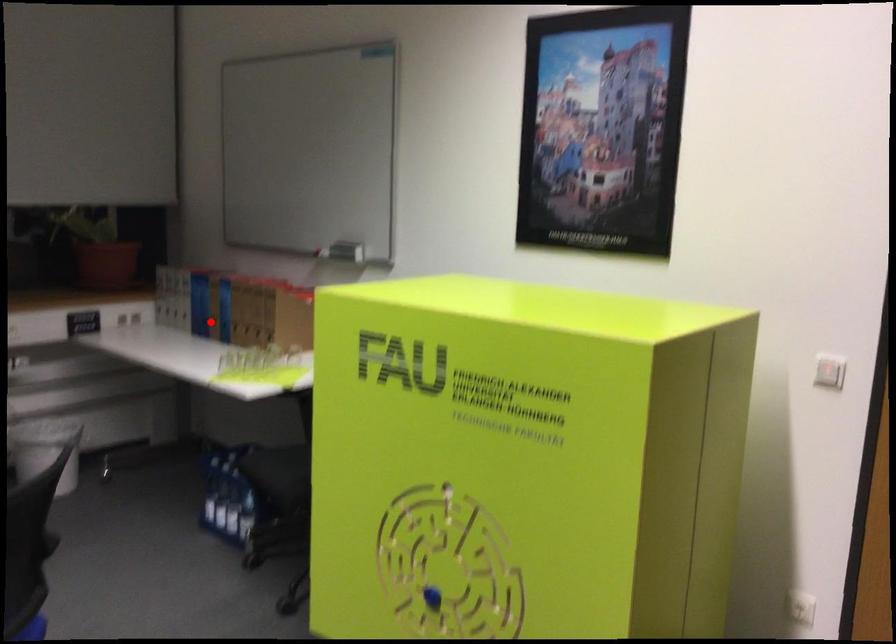
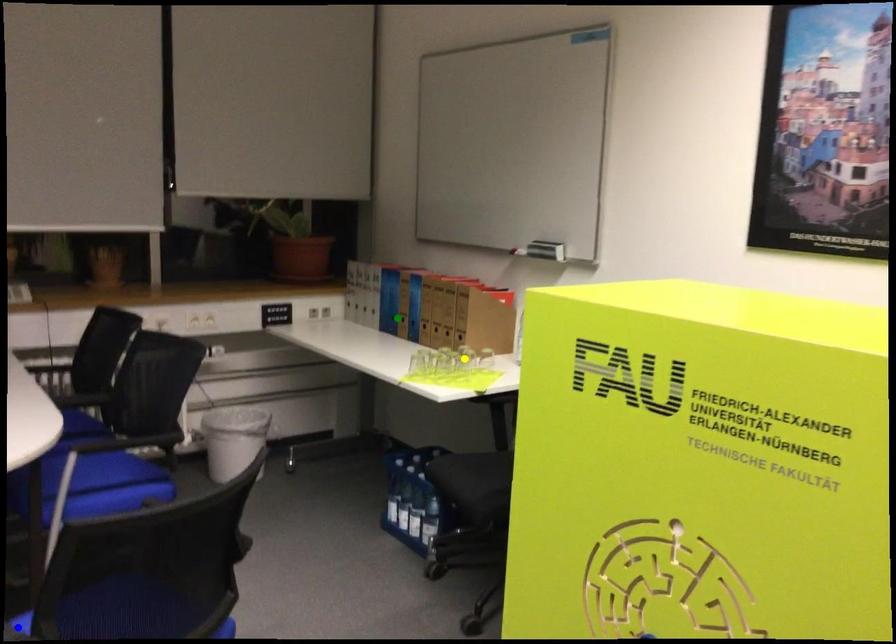
Question: I am providing you with two images of the same scene from different viewpoints. A red point is marked on the first image. You are given multiple points on the second image. Which point in image 2 is actually the same real-world point as the red point in image 1?

Choices:
 (A) yellow point
 (B) blue point
 (C) green point

Answer: (C)